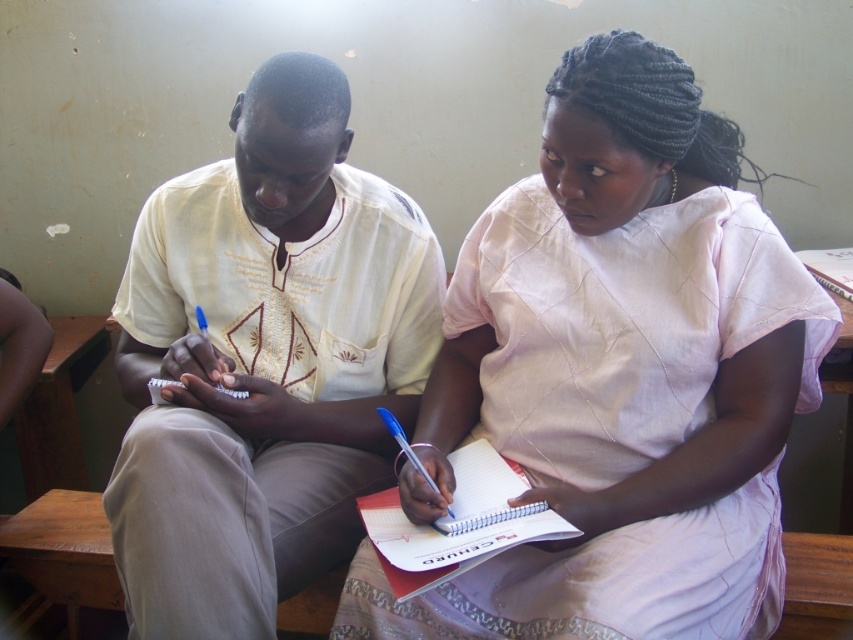
Image resolution: width=853 pixels, height=640 pixels. What do you see at coordinates (264, 362) in the screenshot?
I see `light beige embroidered shirt at center` at bounding box center [264, 362].

What are the coordinates of `light beige embroidered shirt at center` in the screenshot? It's located at (264, 362).

This screenshot has width=853, height=640. In order to click on light beige embroidered shirt at center in this screenshot , I will do `click(264, 362)`.

Between point (711, 289) and point (381, 452), which one is positioned in front?

Point (711, 289) is more forward.

Between light pink fabric dress at center and light beige embroidered shirt at center, which one has less height?

With less height is light beige embroidered shirt at center.

Which is behind, point (689, 480) or point (212, 483)?

The point (689, 480) is more distant.

At what (x,y) coordinates should I click in order to perform the action: click on light pink fabric dress at center. Please return your answer as a coordinate pair (x, y). The height and width of the screenshot is (640, 853). Looking at the image, I should click on (618, 376).

Does light pink fabric dress at center have a greater width compared to white spiral notebook at center?

Yes.

Describe the element at coordinates (618, 376) in the screenshot. The image size is (853, 640). I see `light pink fabric dress at center` at that location.

I want to click on light pink fabric dress at center, so (618, 376).